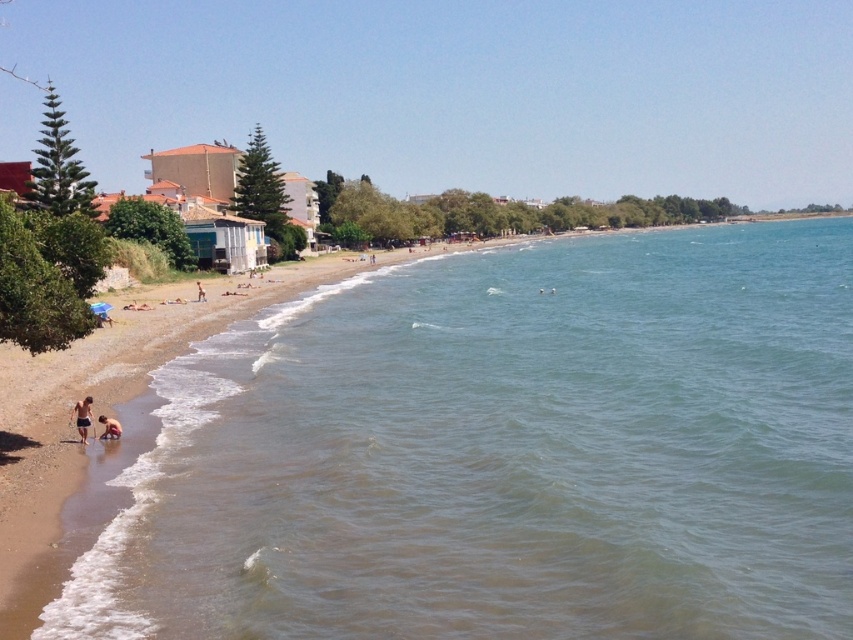
Which is behind, point (108, 417) or point (198, 291)?

The point (198, 291) is behind.

Is light brown sand at lower left wider than tan skin person at lower left?

No.

You are a GUI agent. You are given a task and a screenshot of the screen. Output one action in this format:
    pyautogui.click(x=<x>, y=<y>)
    Task: Click on the light brown sand at lower left
    Image resolution: width=853 pixels, height=640 pixels.
    Given the screenshot: What is the action you would take?
    pyautogui.click(x=109, y=428)

Is tan skin human at lower left thinner than tan skin person at lower left?

Yes.

Looking at this image, which of these two, tan skin human at lower left or tan skin person at lower left, stands shorter?

tan skin human at lower left

Measure the distance between point (90, 413) and camera.

Point (90, 413) and camera are 22.44 meters apart.

This screenshot has width=853, height=640. Find the location of `tan skin human at lower left`. tan skin human at lower left is located at coordinates (82, 417).

Does brown sand at lower left have a greater height compared to tan skin person at lower left?

Yes.

Does brown sand at lower left have a greater width compared to tan skin person at lower left?

Yes.

Measure the distance between brown sand at lower left and camera.

They are 39.55 feet apart.

The image size is (853, 640). Find the location of `brown sand at lower left`. brown sand at lower left is located at coordinates (505, 452).